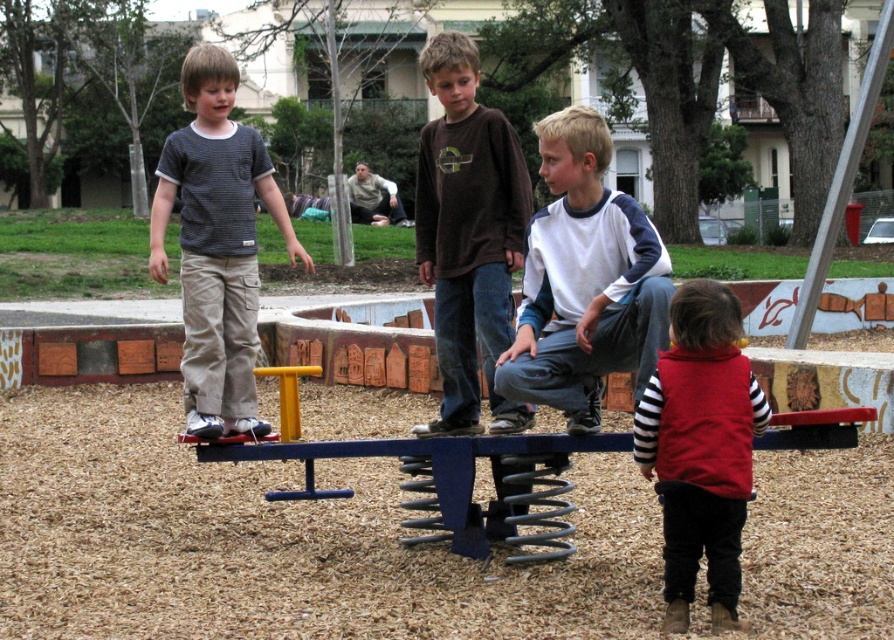
You are a parent supervising children at the playground. You notice two children, one wearing a striped cotton shirt at center and another in a red fleece vest at lower right. Which child is closer to you?

The striped cotton shirt at center is closer to you because it is further to the viewer than the red fleece vest at lower right.